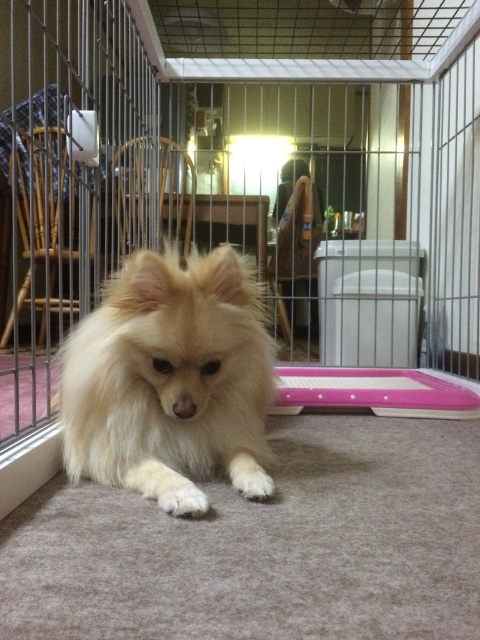
Question: Can you confirm if transparent glass door at center is positioned to the left of fluffy white dog at center?

Choices:
 (A) yes
 (B) no

Answer: (B)

Question: Is transparent glass door at center thinner than fluffy white dog at center?

Choices:
 (A) yes
 (B) no

Answer: (B)

Question: Does transparent glass door at center have a larger size compared to fluffy white dog at center?

Choices:
 (A) no
 (B) yes

Answer: (B)

Question: Among these points, which one is nearest to the camera?

Choices:
 (A) (217, 346)
 (B) (253, 244)

Answer: (A)